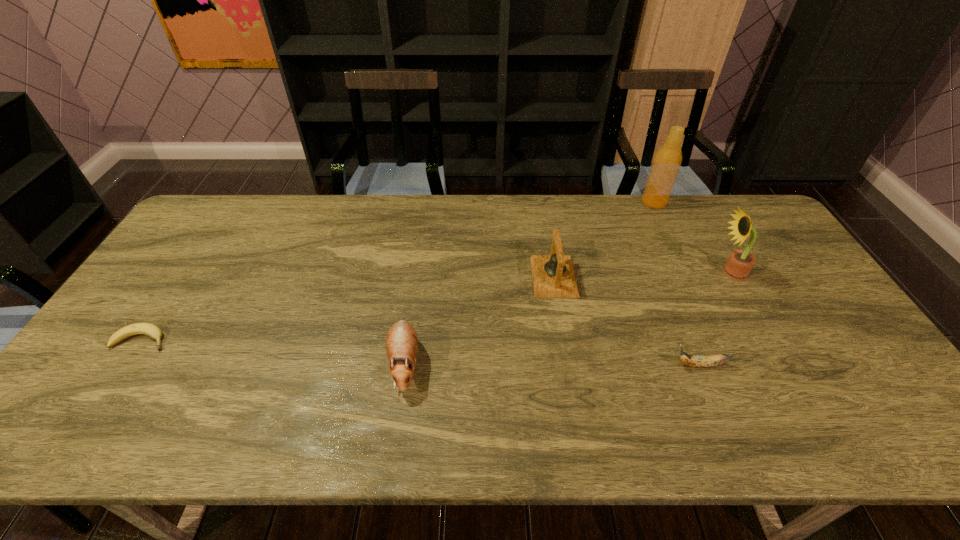
Identify the location of vacant area located 0.230m on the left of the beer bottle. (577, 202).

I want to click on free space located 0.280m on the face of the fifth shortest object, so click(x=621, y=273).

Identify the location of vacant space situated on the face of the fifth shortest object. (647, 273).

At what (x,y) coordinates should I click in order to perform the action: click on vacant space located 0.130m on the face of the fifth shortest object. Please return your answer as a coordinate pair (x, y). The height and width of the screenshot is (540, 960). Looking at the image, I should click on (671, 273).

The image size is (960, 540). Identify the location of vacant space located on the right of the third object from left to right. (689, 276).

At what (x,y) coordinates should I click in order to perform the action: click on free location located at the stem of the fifth tallest object. Please return your answer as a coordinate pair (x, y). This screenshot has height=540, width=960. Looking at the image, I should click on click(x=515, y=365).

Image resolution: width=960 pixels, height=540 pixels. Find the location of `blank space located 0.300m at the stem of the fifth tallest object`. blank space located 0.300m at the stem of the fifth tallest object is located at coordinates (551, 365).

The image size is (960, 540). I want to click on free space located 0.170m at the stem of the fifth tallest object, so click(604, 365).

Locate an element on the screen. The width and height of the screenshot is (960, 540). vacant region located 0.120m at the stem of the farther banana is located at coordinates (215, 340).

You are a GUI agent. You are given a task and a screenshot of the screen. Output one action in this format:
    pyautogui.click(x=<x>, y=<y>)
    Task: Click on the object that is at the far edge
    
    Given the screenshot: What is the action you would take?
    pyautogui.click(x=666, y=163)